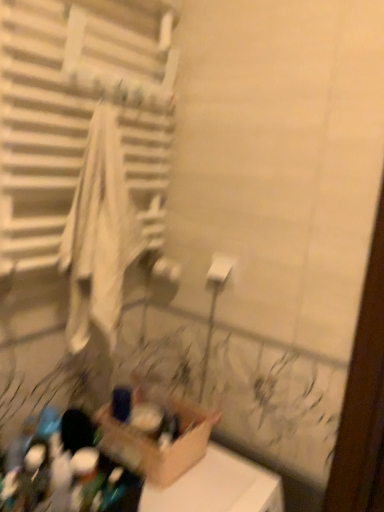
Question: Is white fabric towel at left not inside white matte toilet paper at center?

Choices:
 (A) no
 (B) yes

Answer: (B)

Question: From a real-world perspective, is white fabric towel at left beneath white matte toilet paper at center?

Choices:
 (A) no
 (B) yes

Answer: (A)

Question: Is the depth of white fabric towel at left less than that of white matte toilet paper at center?

Choices:
 (A) no
 (B) yes

Answer: (B)

Question: Is white fabric towel at left not close to white matte toilet paper at center?

Choices:
 (A) yes
 (B) no

Answer: (B)

Question: Is white fabric towel at left aimed at white matte toilet paper at center?

Choices:
 (A) yes
 (B) no

Answer: (B)

Question: Would you say white matte toilet paper at center is inside or outside cardboard box at lower center?

Choices:
 (A) inside
 (B) outside

Answer: (B)

Question: Relative to cardboard box at lower center, is white matte toilet paper at center in front or behind?

Choices:
 (A) behind
 (B) front

Answer: (A)

Question: In the image, is white matte toilet paper at center on the left side or the right side of cardboard box at lower center?

Choices:
 (A) left
 (B) right

Answer: (B)

Question: Is point (223, 268) positioned closer to the camera than point (185, 443)?

Choices:
 (A) farther
 (B) closer

Answer: (A)

Question: Is cardboard box at lower center to the left or to the right of white fabric towel at left in the image?

Choices:
 (A) right
 (B) left

Answer: (A)

Question: Does point [x=155, y=441] appear closer or farther from the camera than point [x=129, y=206]?

Choices:
 (A) closer
 (B) farther

Answer: (B)

Question: Looking at the image, does cardboard box at lower center seem bigger or smaller compared to white fabric towel at left?

Choices:
 (A) big
 (B) small

Answer: (B)

Question: Considering the positions of cardboard box at lower center and white fabric towel at left in the image, is cardboard box at lower center wider or thinner than white fabric towel at left?

Choices:
 (A) wide
 (B) thin

Answer: (A)

Question: In the image, is cardboard box at lower center on the left side or the right side of white matte toilet paper at center?

Choices:
 (A) left
 (B) right

Answer: (A)

Question: From a real-world perspective, is cardboard box at lower center positioned above or below white matte toilet paper at center?

Choices:
 (A) above
 (B) below

Answer: (B)